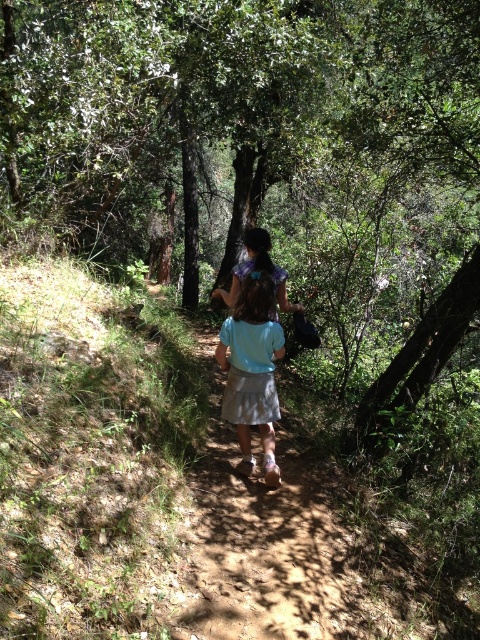
Question: Among these objects, which one is farthest from the camera?

Choices:
 (A) light blue fabric at center
 (B) light blue fabric shirt at center

Answer: (A)

Question: Is green leafy tree at center bigger than light blue fabric dress at center?

Choices:
 (A) no
 (B) yes

Answer: (B)

Question: Does light blue fabric shirt at center appear under light blue fabric dress at center?

Choices:
 (A) yes
 (B) no

Answer: (A)

Question: In this image, where is green leafy tree at center located relative to light blue fabric at center?

Choices:
 (A) right
 (B) left

Answer: (B)

Question: Which object appears closest to the camera in this image?

Choices:
 (A) light blue fabric dress at center
 (B) light blue fabric at center

Answer: (A)

Question: Which point is closer to the camera?

Choices:
 (A) green leafy tree at center
 (B) light blue fabric dress at center
 (C) light blue fabric shirt at center

Answer: (A)